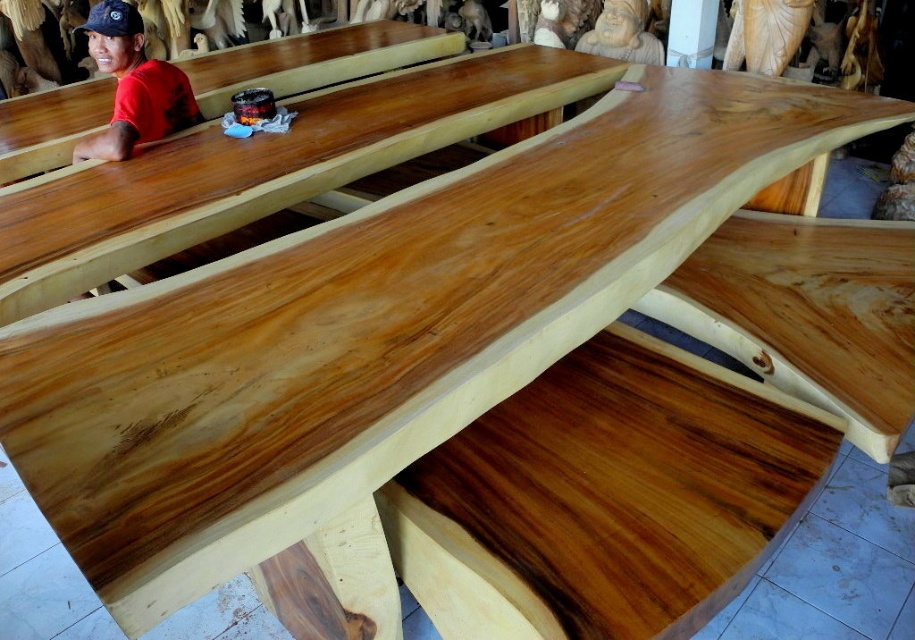
Question: Among these objects, which one is nearest to the camera?

Choices:
 (A) black fabric baseball cap at upper left
 (B) red matte shirt at left
 (C) matte brown statue at upper center

Answer: (B)

Question: Is glossy wood table at upper center smaller than black fabric baseball cap at upper left?

Choices:
 (A) no
 (B) yes

Answer: (A)

Question: Is polished wood plank at center wider than glossy wood table at upper center?

Choices:
 (A) no
 (B) yes

Answer: (A)

Question: Does matte brown statue at upper center come behind black fabric baseball cap at upper left?

Choices:
 (A) no
 (B) yes

Answer: (B)

Question: Which object is closer to the camera taking this photo?

Choices:
 (A) red matte shirt at left
 (B) matte brown statue at upper center

Answer: (A)

Question: Which object is farther from the camera taking this photo?

Choices:
 (A) polished wood plank at center
 (B) matte brown statue at upper center
 (C) natural wood table at left

Answer: (B)